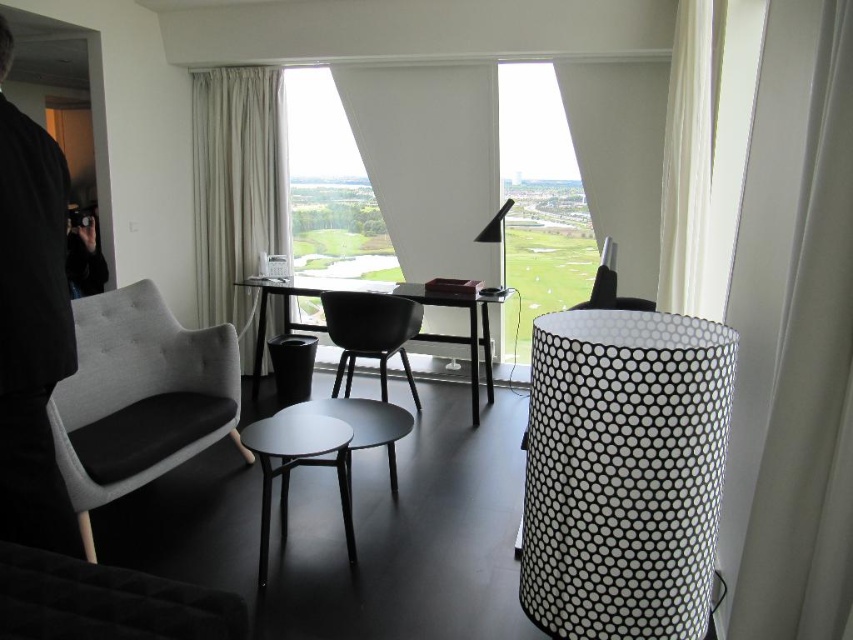
Does green grass at center have a lesser height compared to black matte stool at center?

In fact, green grass at center may be taller than black matte stool at center.

Image resolution: width=853 pixels, height=640 pixels. I want to click on green grass at center, so point(541,280).

At what (x,y) coordinates should I click in order to perform the action: click on green grass at center. Please return your answer as a coordinate pair (x, y). The width and height of the screenshot is (853, 640). Looking at the image, I should click on (541, 280).

Which is behind, point (260, 577) or point (376, 300)?

The point (376, 300) is more distant.

Between black matte stool at center and matte black chair at center, which one appears on the left side from the viewer's perspective?

black matte stool at center is more to the left.

Which is in front, point (347, 557) or point (364, 330)?

Point (347, 557)

Where is `black matte stool at center`? This screenshot has height=640, width=853. black matte stool at center is located at coordinates (299, 464).

Can you confirm if light gray fabric armchair at left is positioned below matte black stool at center?

No.

Does light gray fabric armchair at left come in front of matte black stool at center?

That is True.

Is point (213, 400) positioned before point (354, 444)?

No, it is not.

Locate an element on the screen. The width and height of the screenshot is (853, 640). light gray fabric armchair at left is located at coordinates (138, 397).